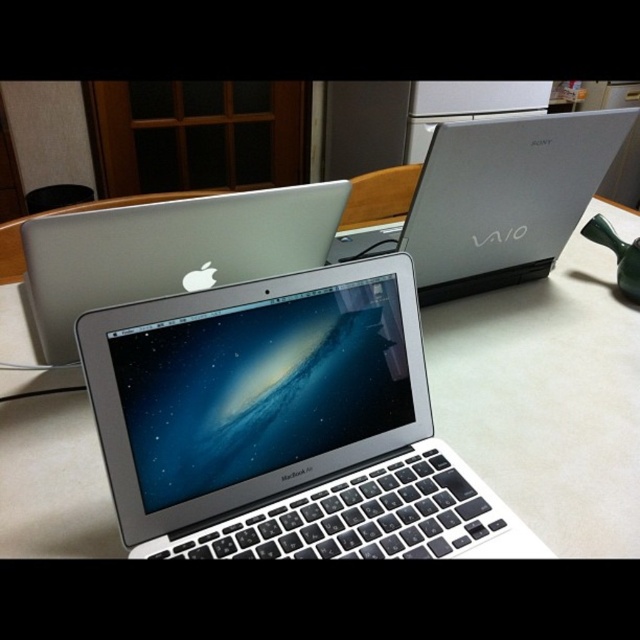
You are organizing a small tech fair and need to place a satin silver laptop at center on a white glossy table at center. Given the table and laptop are both silver, how can you ensure the laptop is clearly visible on the table?

The white glossy table at center is wider than the satin silver laptop at center, so placing the laptop centrally would allow its edges to be clearly visible against the table surface.

You are a delivery person who needs to place a 20 cm wide package on the table. Can you fit it between the white glossy table at center and the sleek silver laptop at center?

The distance between the white glossy table at center and the sleek silver laptop at center is 17.57 centimeters. Since the package is 20 cm wide, it cannot fit in the available space.